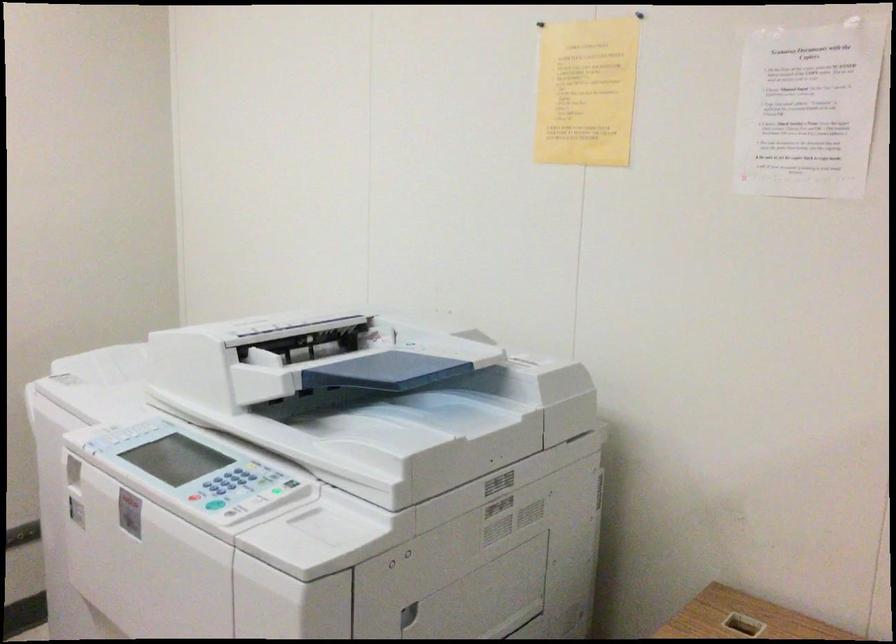
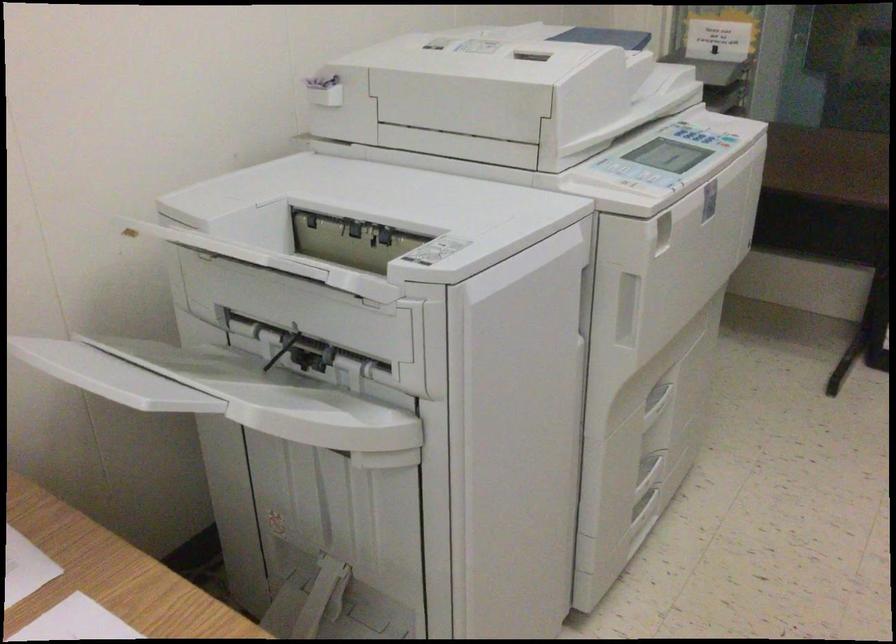
First-person continuous shooting, in which direction is the camera rotating?

The camera rotated toward right-down.